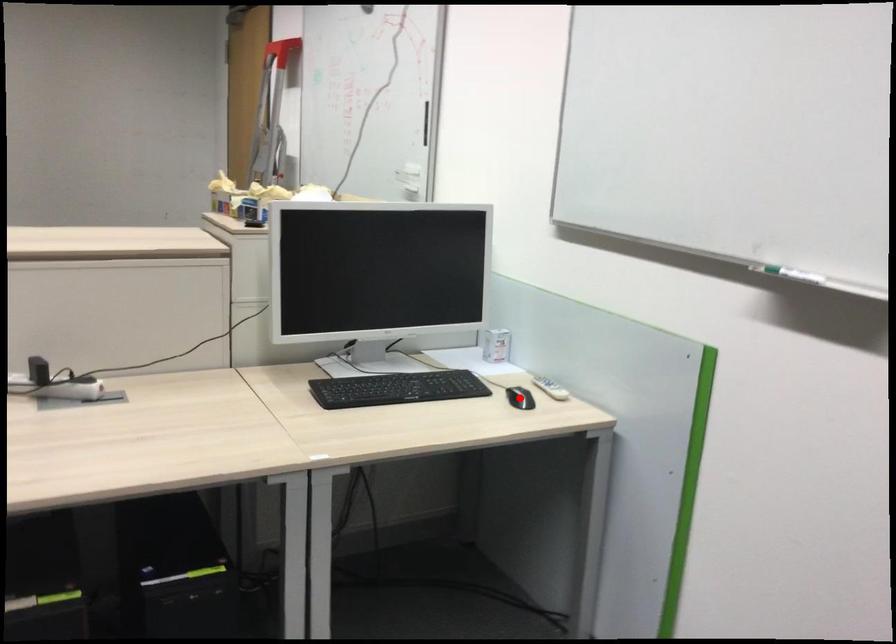
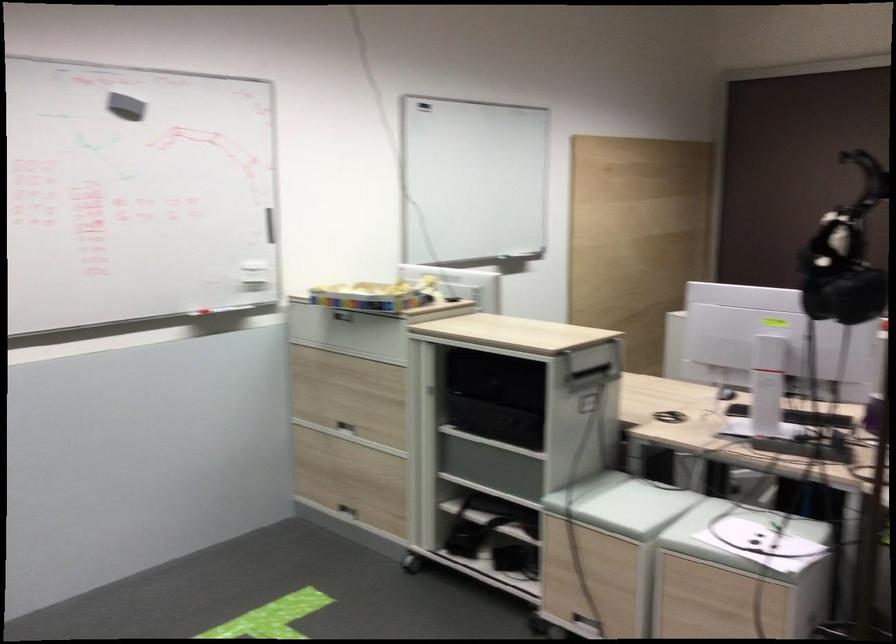
Question: I am providing you with two images of the same scene from different viewpoints. A red point is marked on the first image. Is the red point's position out of view in image 2?

Choices:
 (A) Yes
 (B) No

Answer: (A)